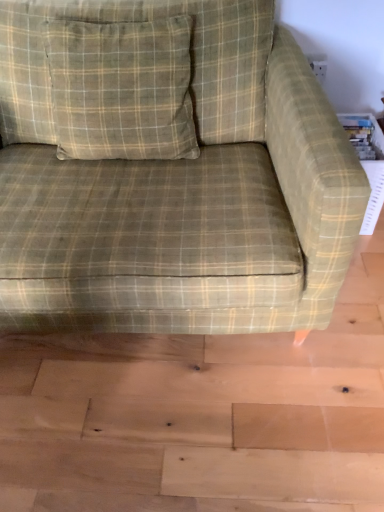
Question: Is green plaid fabric couch at center outside green plaid pillow at upper left?

Choices:
 (A) no
 (B) yes

Answer: (B)

Question: Is green plaid fabric couch at center surrounding green plaid pillow at upper left?

Choices:
 (A) no
 (B) yes

Answer: (B)

Question: From a real-world perspective, is green plaid fabric couch at center positioned under green plaid pillow at upper left based on gravity?

Choices:
 (A) yes
 (B) no

Answer: (A)

Question: From the image's perspective, is green plaid fabric couch at center over green plaid pillow at upper left?

Choices:
 (A) no
 (B) yes

Answer: (A)

Question: Can you confirm if green plaid fabric couch at center is smaller than green plaid pillow at upper left?

Choices:
 (A) yes
 (B) no

Answer: (B)

Question: Does green plaid fabric couch at center have a lesser height compared to green plaid pillow at upper left?

Choices:
 (A) yes
 (B) no

Answer: (B)

Question: From the image's perspective, is green plaid pillow at upper left located beneath green plaid fabric couch at center?

Choices:
 (A) no
 (B) yes

Answer: (A)

Question: Does green plaid pillow at upper left have a greater width compared to green plaid fabric couch at center?

Choices:
 (A) no
 (B) yes

Answer: (A)

Question: Is green plaid pillow at upper left thinner than green plaid fabric couch at center?

Choices:
 (A) yes
 (B) no

Answer: (A)

Question: Can you confirm if green plaid pillow at upper left is positioned to the right of green plaid fabric couch at center?

Choices:
 (A) no
 (B) yes

Answer: (A)

Question: Is green plaid pillow at upper left facing away from green plaid fabric couch at center?

Choices:
 (A) yes
 (B) no

Answer: (A)

Question: Considering the relative sizes of green plaid pillow at upper left and green plaid fabric couch at center in the image provided, is green plaid pillow at upper left taller than green plaid fabric couch at center?

Choices:
 (A) yes
 (B) no

Answer: (B)

Question: From a real-world perspective, is green plaid pillow at upper left positioned above or below green plaid fabric couch at center?

Choices:
 (A) below
 (B) above

Answer: (B)